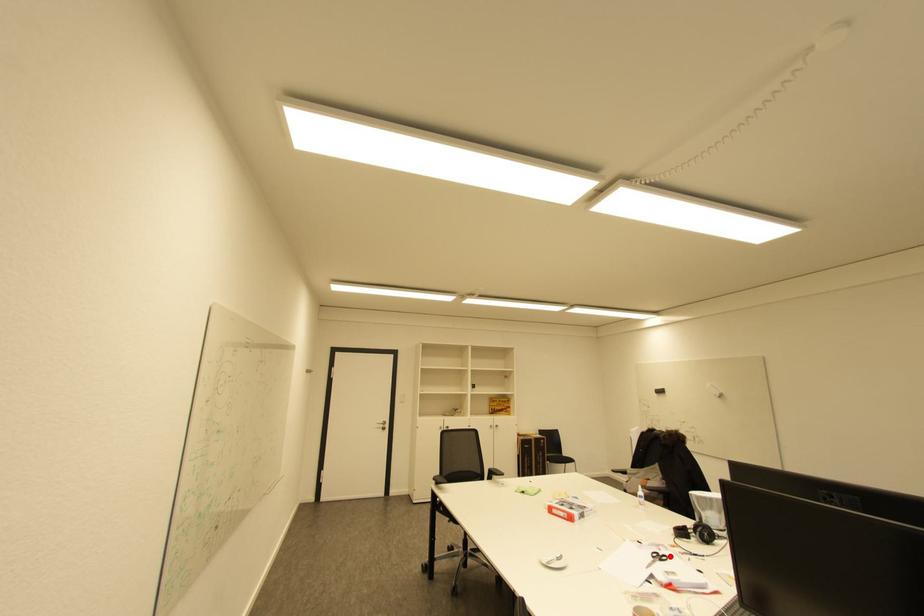
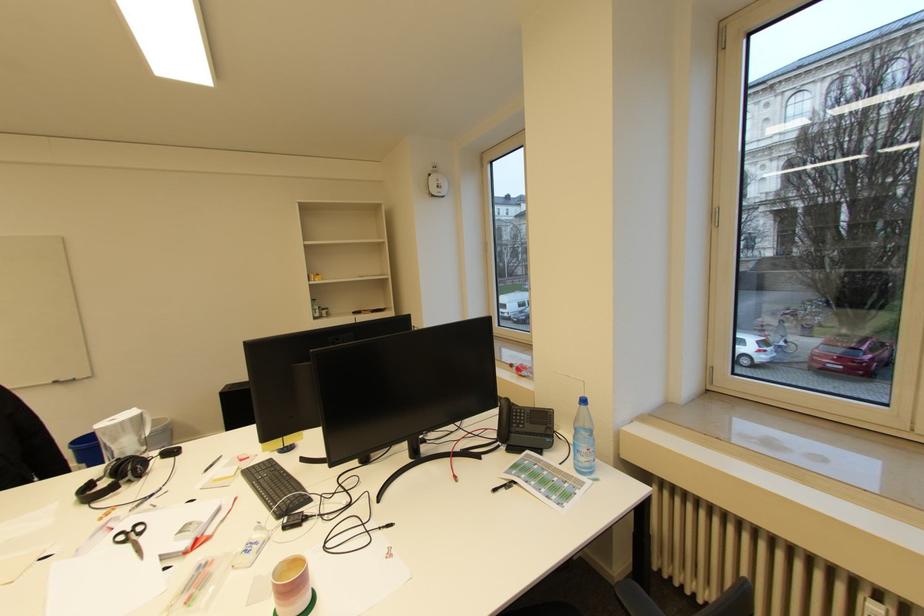
In the second image, find the point that corresponds to the highlighted location in the first image.

(141, 525)